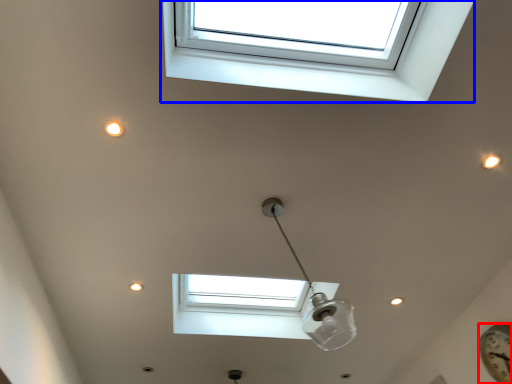
Question: Which object appears farthest to the camera in this image, clock (highlighted by a red box) or window (highlighted by a blue box)?

Choices:
 (A) clock
 (B) window

Answer: (A)